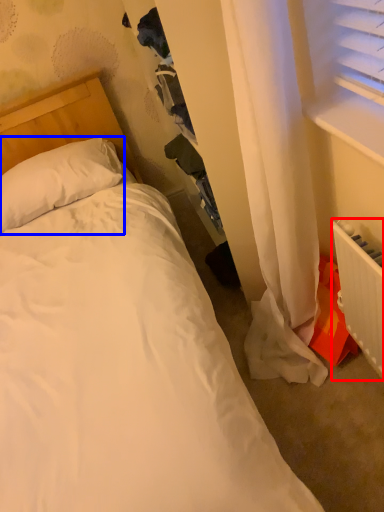
Question: Among these objects, which one is nearest to the camera, radiator (highlighted by a red box) or pillow (highlighted by a blue box)?

Choices:
 (A) radiator
 (B) pillow

Answer: (A)